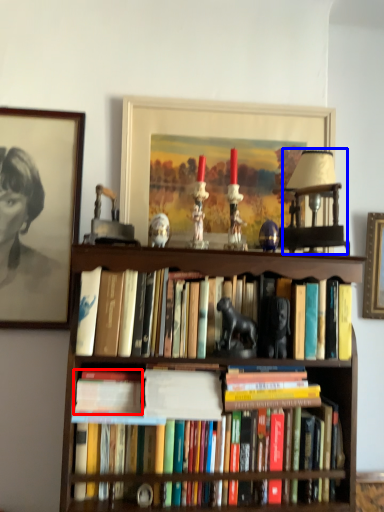
Question: Which object appears closest to the camera in this image, paperback book (highlighted by a red box) or lamp (highlighted by a blue box)?

Choices:
 (A) paperback book
 (B) lamp

Answer: (A)